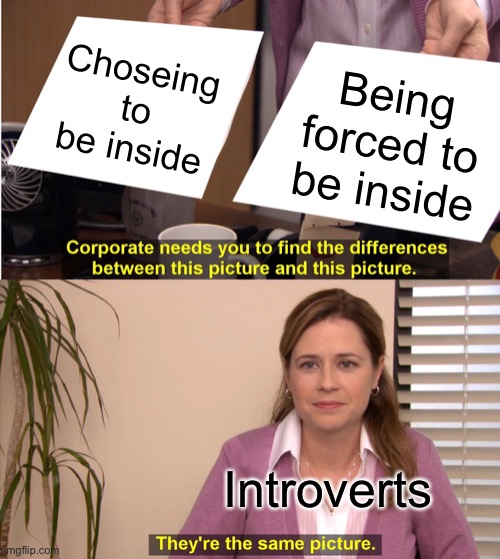
Locate an element on the screen. The height and width of the screenshot is (559, 500). plant is located at coordinates (40, 350).